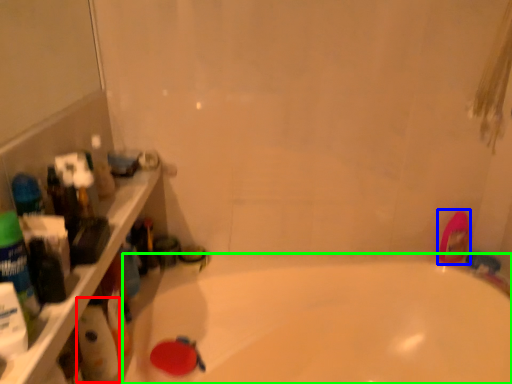
Question: Which object is positioned farthest from cleaning product (highlighted by a red box)? Select from mouthwash (highlighted by a blue box) and bathtub (highlighted by a green box).

Choices:
 (A) mouthwash
 (B) bathtub

Answer: (A)